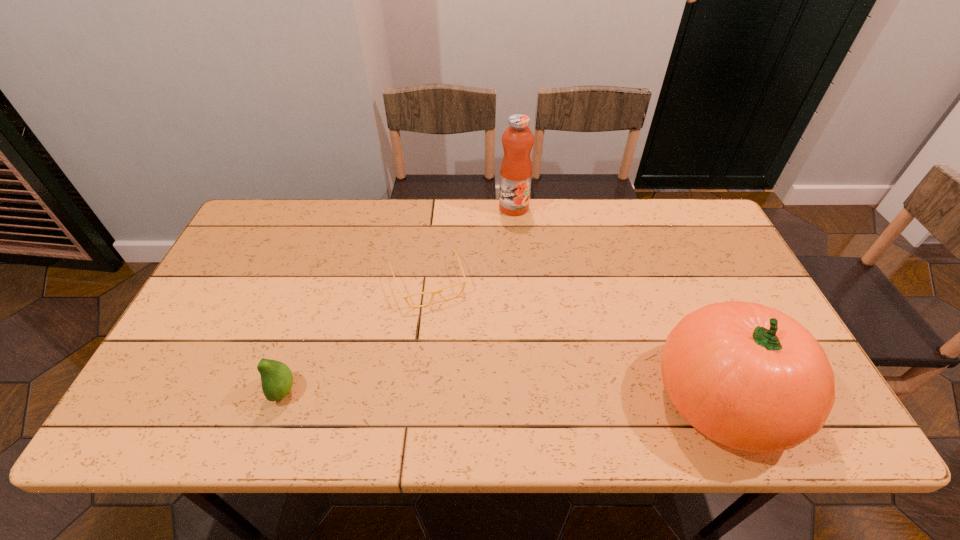
Locate an element on the screen. This screenshot has height=540, width=960. vacant area located 0.270m on the cut side of the third tallest object is located at coordinates (156, 390).

The width and height of the screenshot is (960, 540). In order to click on vacant space located 0.400m on the back of the rightmost object in this screenshot , I will do pyautogui.click(x=655, y=236).

This screenshot has height=540, width=960. Find the location of `blank space located in front of the lenses of the third object from right to left`. blank space located in front of the lenses of the third object from right to left is located at coordinates (446, 328).

You are a GUI agent. You are given a task and a screenshot of the screen. Output one action in this format:
    pyautogui.click(x=<x>, y=<y>)
    Task: Click on the vacant space situated 0.170m in front of the lenses of the third object from right to left
    The width and height of the screenshot is (960, 540).
    Given the screenshot: What is the action you would take?
    pyautogui.click(x=458, y=359)

The height and width of the screenshot is (540, 960). I want to click on free space located in front of the lenses of the third object from right to left, so click(x=452, y=343).

I want to click on vacant space located on the front label of the third object from left to right, so click(486, 307).

The height and width of the screenshot is (540, 960). Identify the location of vacant space located on the front label of the third object from left to right. pos(495,274).

At what (x,y) coordinates should I click in order to perform the action: click on vacant space located 0.260m on the front label of the third object from left to right. Please return your answer as a coordinate pair (x, y). Looking at the image, I should click on (495, 271).

You are a GUI agent. You are given a task and a screenshot of the screen. Output one action in this format:
    pyautogui.click(x=<x>, y=<y>)
    Task: Click on the object positioned at the far edge
    The width and height of the screenshot is (960, 540).
    Given the screenshot: What is the action you would take?
    pyautogui.click(x=516, y=167)

Find the location of a particular element. avocado at the near edge is located at coordinates (276, 377).